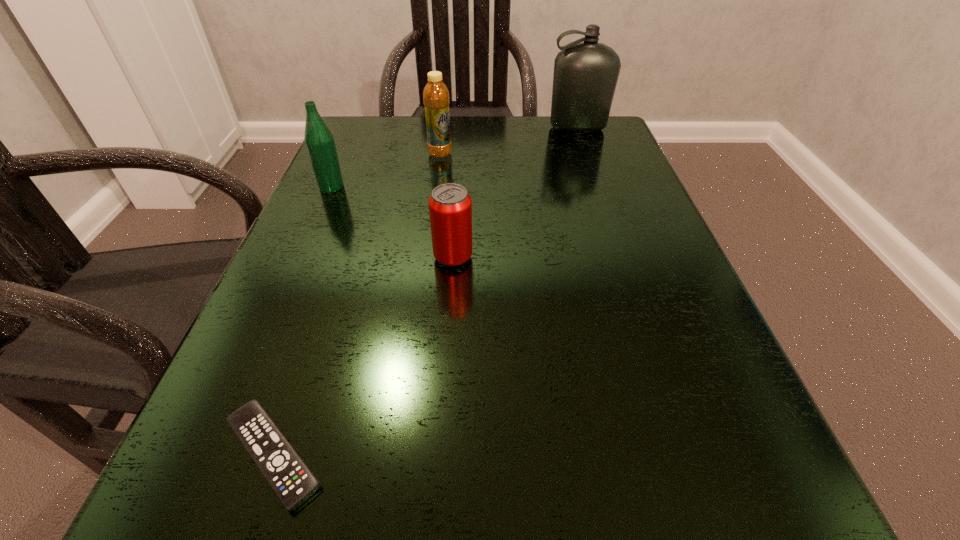
Locate an element on the screen. The height and width of the screenshot is (540, 960). blank region between the fourth farthest object and the leftmost bottle is located at coordinates (393, 222).

I want to click on free space that is in between the second bottle from left to right and the farthest bottle, so click(509, 141).

Image resolution: width=960 pixels, height=540 pixels. Identify the location of free space between the second shortest object and the remote control. (363, 356).

Identify the location of unoccupied area between the rightmost bottle and the nearest object. The width and height of the screenshot is (960, 540). (425, 291).

Locate an element on the screen. This screenshot has width=960, height=540. object that is the fourth nearest to the third farthest object is located at coordinates (585, 76).

Identify which object is the second nearest to the second bottle from right to left. Please provide its 2D coordinates. Your answer should be formatted as a tuple, i.e. [(x, y)], where the tuple contains the x and y coordinates of a point satisfying the conditions above.

[(585, 76)]

Point out which bottle is positioned as the nearest to the second bottle from right to left. Please provide its 2D coordinates. Your answer should be formatted as a tuple, i.e. [(x, y)], where the tuple contains the x and y coordinates of a point satisfying the conditions above.

[(319, 141)]

Choose which bottle is the third nearest neighbor to the fourth farthest object. Please provide its 2D coordinates. Your answer should be formatted as a tuple, i.e. [(x, y)], where the tuple contains the x and y coordinates of a point satisfying the conditions above.

[(585, 76)]

Identify the location of vacant area that satisfies the following two spatial constraints: 1. on the front side of the second nearest object; 2. on the right side of the leftmost bottle. Image resolution: width=960 pixels, height=540 pixels. (300, 258).

Where is `vacant position in the image that satisfies the following two spatial constraints: 1. on the front side of the nearest object; 2. on the right side of the leftmost bottle`? This screenshot has width=960, height=540. vacant position in the image that satisfies the following two spatial constraints: 1. on the front side of the nearest object; 2. on the right side of the leftmost bottle is located at coordinates (214, 454).